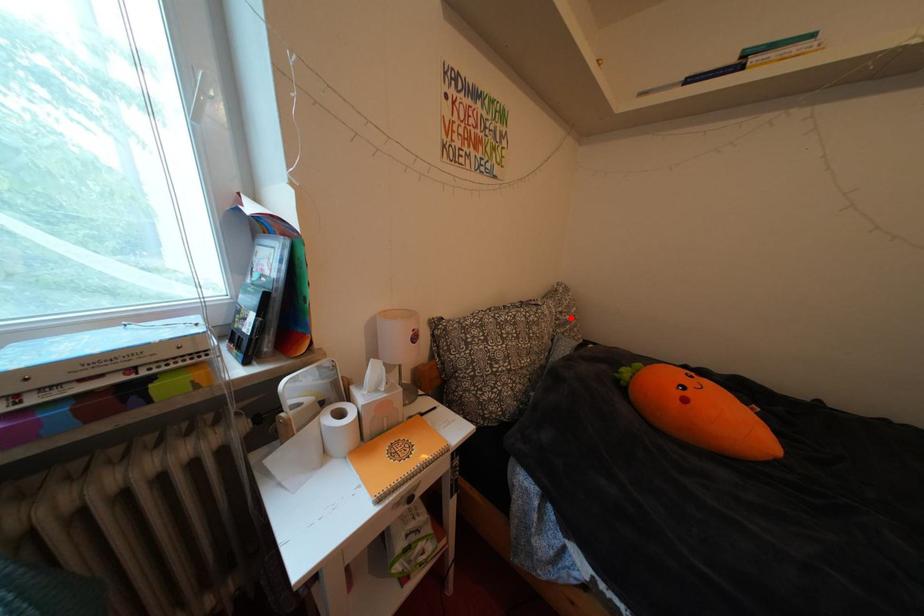
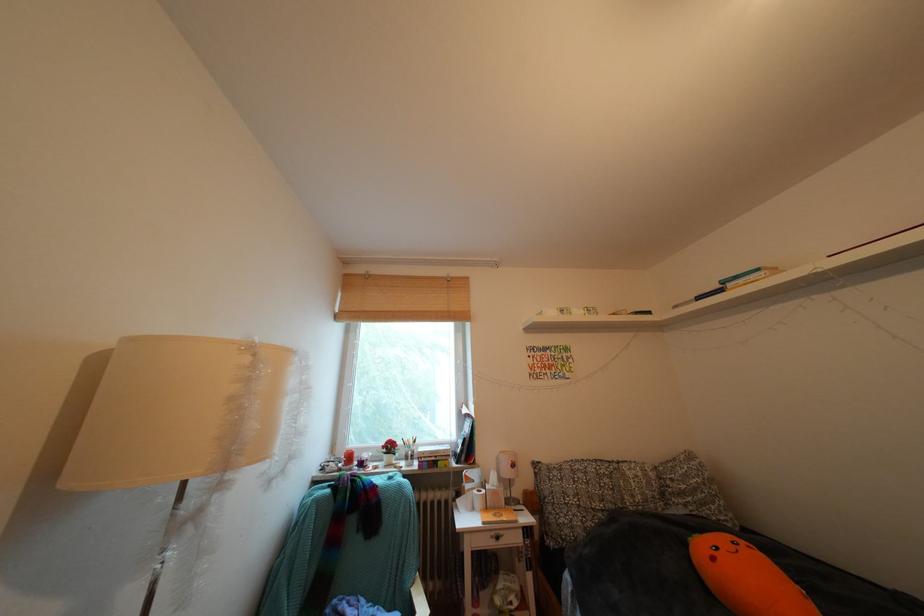
The point at the highlighted location is marked in the first image. Where is the corresponding point in the second image?

(682, 485)